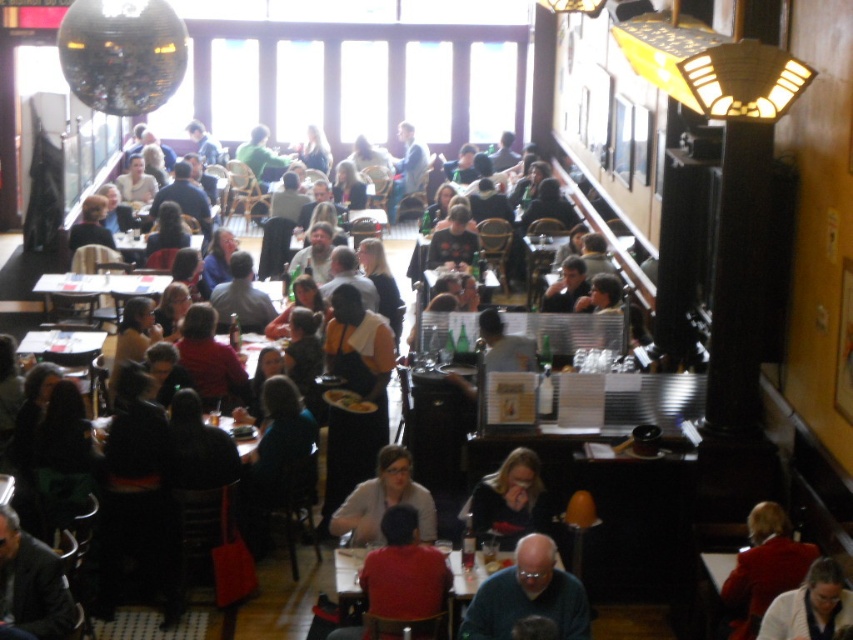
Between red matte shirt at lower center and dark gray suit at lower left, which one is positioned lower?

red matte shirt at lower center

Is red matte shirt at lower center to the left of dark gray suit at lower left from the viewer's perspective?

Incorrect, red matte shirt at lower center is not on the left side of dark gray suit at lower left.

Where is `red matte shirt at lower center`? red matte shirt at lower center is located at coordinates (404, 572).

Is gray sweater at center positioned before white fabric shirt at lower right?

No, gray sweater at center is further to the viewer.

Is point (521, 550) farther from viewer compared to point (808, 611)?

Yes, it is.

The image size is (853, 640). Find the location of `gray sweater at center`. gray sweater at center is located at coordinates (527, 595).

You are a GUI agent. You are given a task and a screenshot of the screen. Output one action in this format:
    pyautogui.click(x=<x>, y=<y>)
    Task: Click on the gray sweater at center
    This screenshot has width=853, height=640.
    Given the screenshot: What is the action you would take?
    pyautogui.click(x=527, y=595)

Can you confirm if matte gray sweater at center is positioned to the right of white plastic table at center?

Indeed, matte gray sweater at center is positioned on the right side of white plastic table at center.

Looking at this image, does matte gray sweater at center appear on the left side of white plastic table at center?

In fact, matte gray sweater at center is to the right of white plastic table at center.

Identify the location of matte gray sweater at center. Image resolution: width=853 pixels, height=640 pixels. pos(384,500).